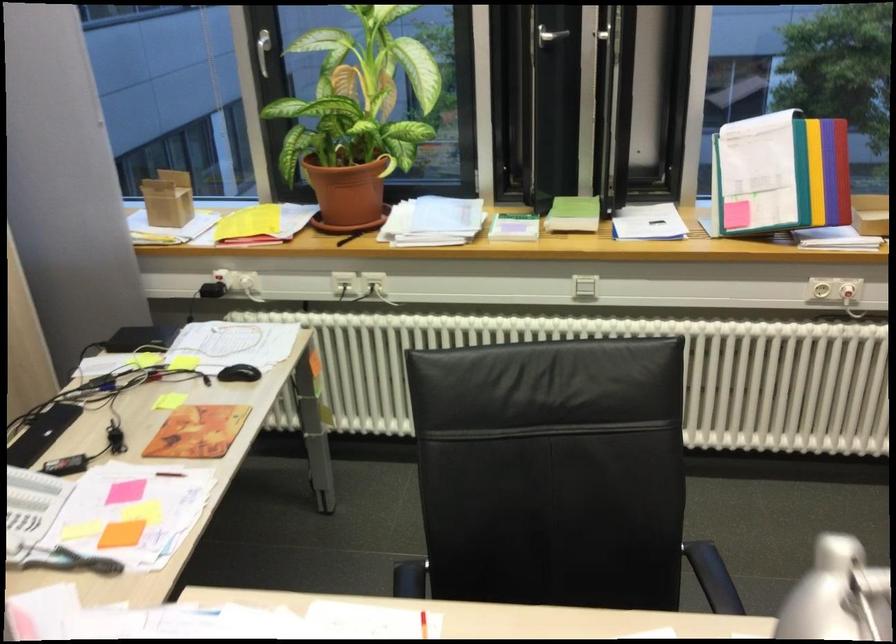
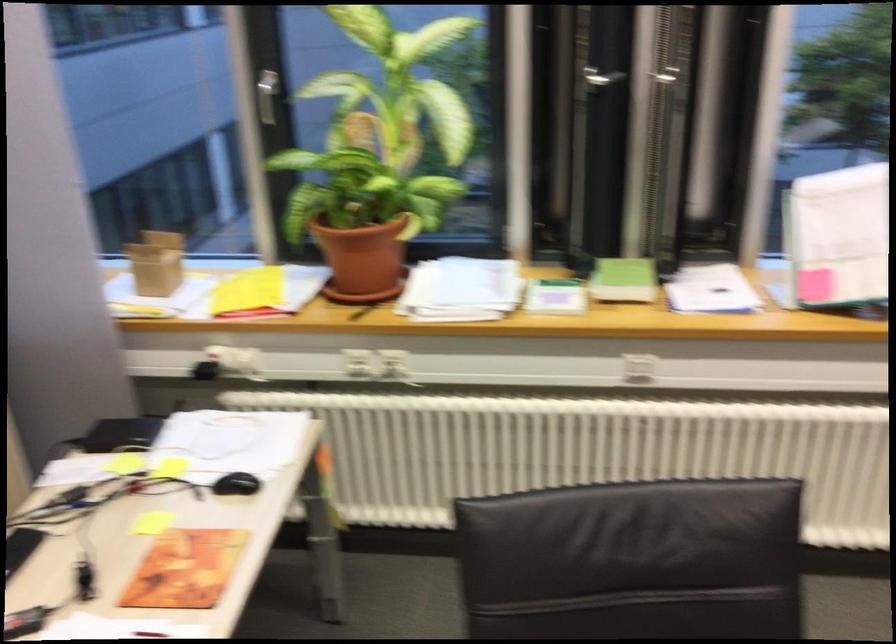
Find the pixel in the second image that matches point (168, 198) in the first image.

(156, 263)